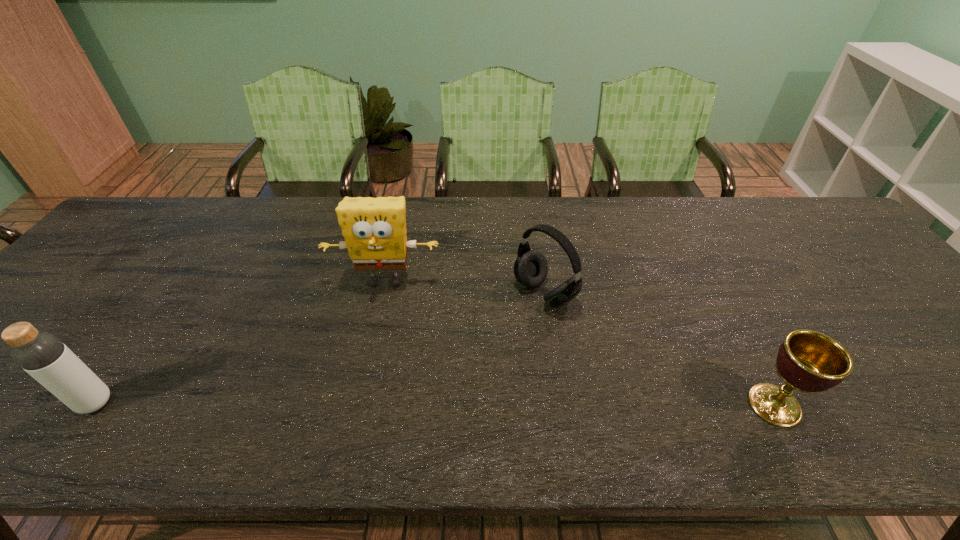
The image size is (960, 540). Find the location of `free space on the desktop that is between the leftmost object and the rightmost object and is positioned on the ear cups of the third object from left to right`. free space on the desktop that is between the leftmost object and the rightmost object and is positioned on the ear cups of the third object from left to right is located at coordinates (379, 404).

The height and width of the screenshot is (540, 960). What are the coordinates of `free space on the desktop that is between the leftmost object and the rightmost object and is positioned on the face of the sponge` in the screenshot? It's located at (362, 403).